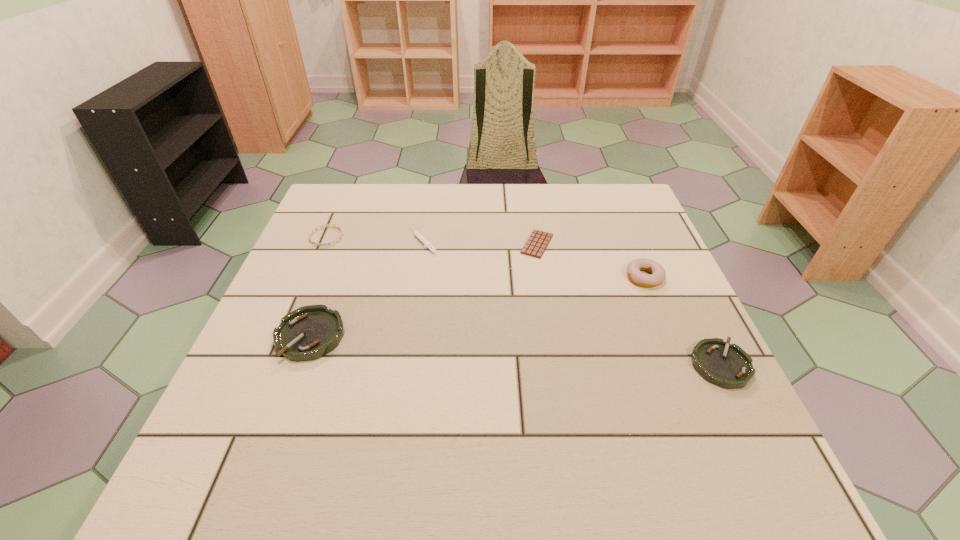
To make them evenly spaced by inserting another ashtray among them, please locate a vacant spot for this new ashtray. Please provide its 2D coordinates. Your answer should be formatted as a tuple, i.e. [(x, y)], where the tuple contains the x and y coordinates of a point satisfying the conditions above.

[(509, 350)]